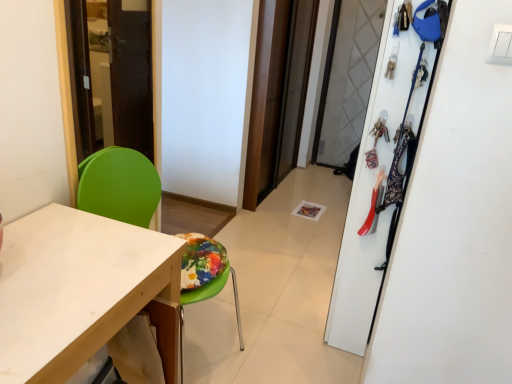
The width and height of the screenshot is (512, 384). What are the coordinates of `vacant point above white matte desk at lower left (from a real-world perspective)` in the screenshot? It's located at (57, 264).